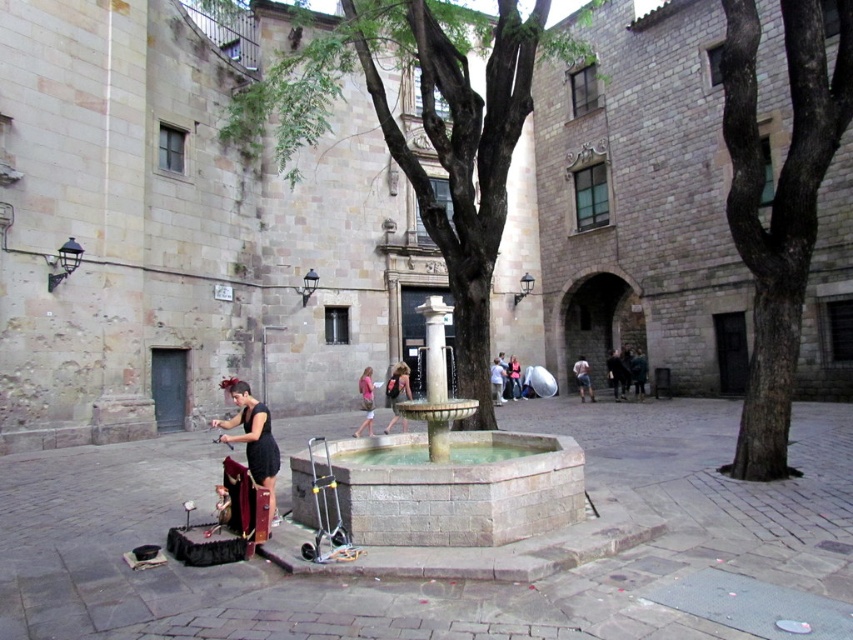
Question: Which point is farther to the camera?

Choices:
 (A) pink fabric dress at center
 (B) stone fountain at center

Answer: (A)

Question: Which point appears farthest from the camera in this image?

Choices:
 (A) (250, 397)
 (B) (366, 390)
 (C) (395, 536)
 (D) (735, 195)

Answer: (B)

Question: Is green leafy tree at center smaller than pink fabric dress at center?

Choices:
 (A) yes
 (B) no

Answer: (B)

Question: Is smooth gray bark at center behind black fabric street artist at center?

Choices:
 (A) no
 (B) yes

Answer: (B)

Question: Considering the real-world distances, which object is closest to the stone fountain at center?

Choices:
 (A) pink fabric dress at center
 (B) smooth gray bark at center

Answer: (B)

Question: In this image, where is smooth gray bark at center located relative to matte black dress at center?

Choices:
 (A) above
 (B) below

Answer: (A)